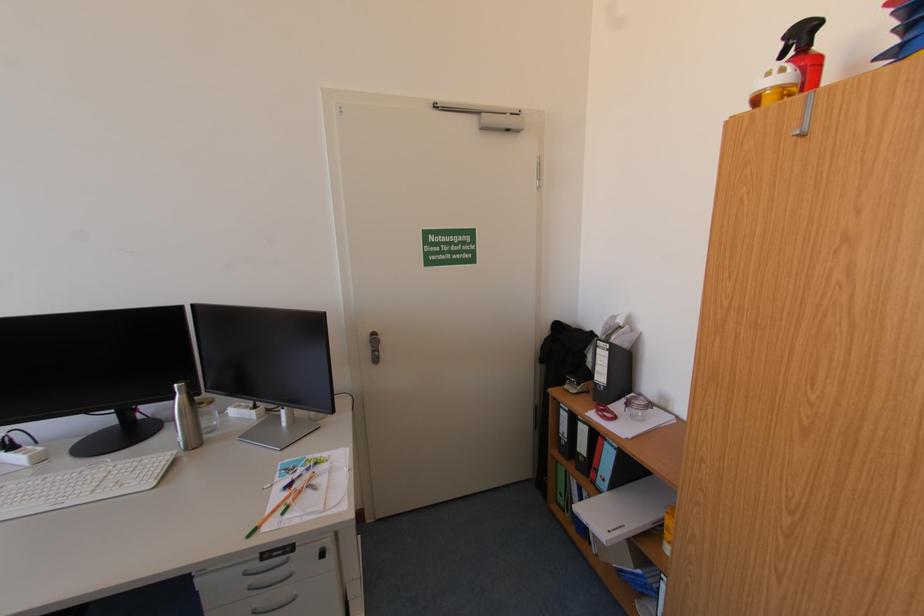
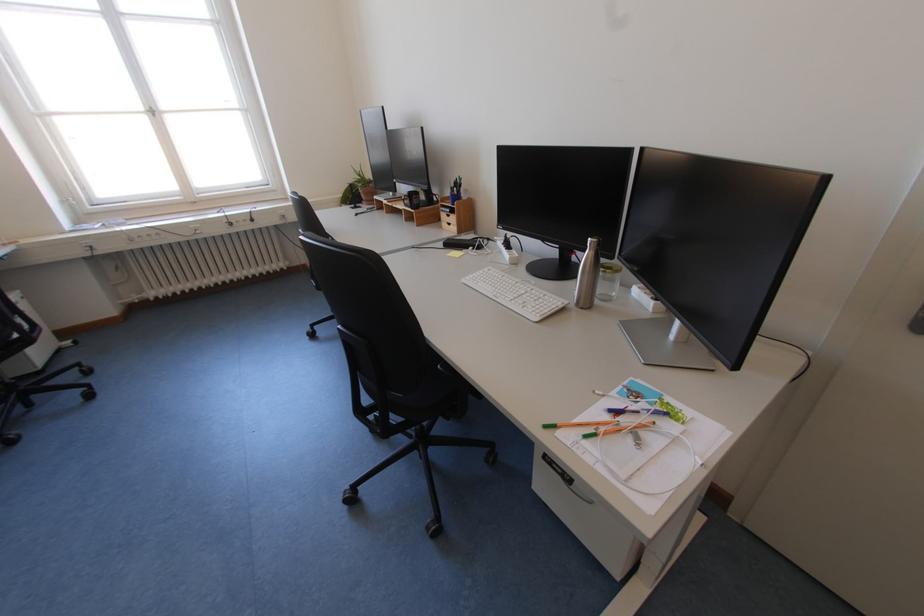
Find the pixel in the second image that matches (290,509) in the first image.

(599, 431)